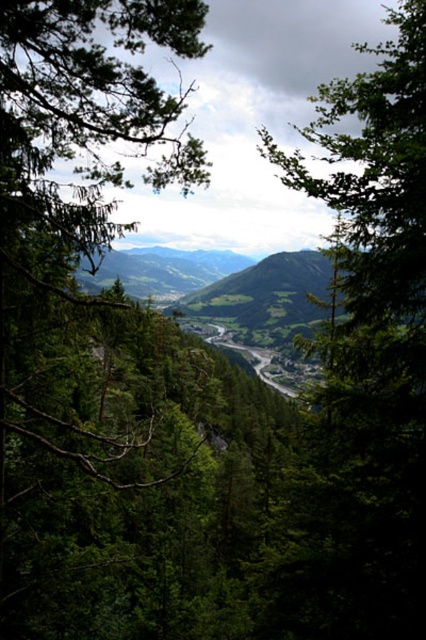
Is green leafy tree at center to the right of green leafy tree at left from the viewer's perspective?

Correct, you'll find green leafy tree at center to the right of green leafy tree at left.

Does green leafy tree at center have a larger size compared to green leafy tree at left?

Indeed, green leafy tree at center has a larger size compared to green leafy tree at left.

Does point (420, 179) come closer to viewer compared to point (138, 24)?

Yes, point (420, 179) is closer to viewer.

At what (x,y) coordinates should I click in order to perform the action: click on green leafy tree at center. Please return your answer as a coordinate pair (x, y). The image size is (426, 640). Looking at the image, I should click on (362, 365).